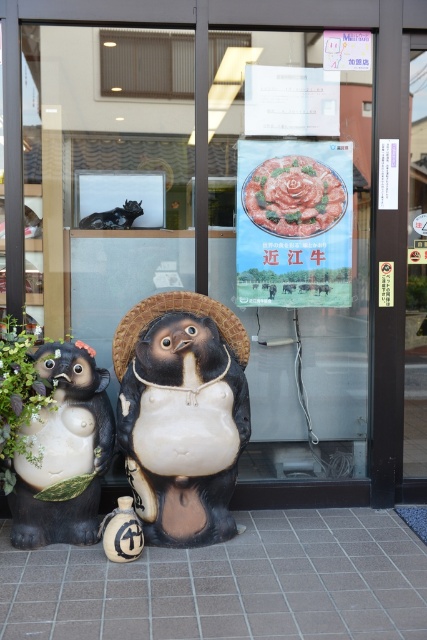
Looking at this image, is the position of matte ceramic penguin at center less distant than that of shiny black cat at upper left?

Yes, matte ceramic penguin at center is closer to the viewer.

Does matte ceramic penguin at center appear over shiny black cat at upper left?

No, matte ceramic penguin at center is not above shiny black cat at upper left.

Between point (160, 500) and point (114, 211), which one is positioned in front?

Point (160, 500)

This screenshot has width=427, height=640. Find the location of `matte ceramic penguin at center`. matte ceramic penguin at center is located at coordinates (181, 413).

Which is more to the left, matte black bear at left or shiny black cat at upper left?

matte black bear at left is more to the left.

Which is more to the right, matte black bear at left or shiny black cat at upper left?

From the viewer's perspective, shiny black cat at upper left appears more on the right side.

Who is more distant from viewer, (34, 483) or (110, 212)?

Positioned behind is point (110, 212).

Identify the location of matte black bear at left. (64, 451).

Which is behind, point (17, 493) or point (146, 320)?

The point (146, 320) is more distant.

Between matte black bear at left and brown woven straw hat at center, which one has less height?

brown woven straw hat at center

The image size is (427, 640). Describe the element at coordinates (64, 451) in the screenshot. I see `matte black bear at left` at that location.

Locate an element on the screen. This screenshot has width=427, height=640. matte black bear at left is located at coordinates (64, 451).